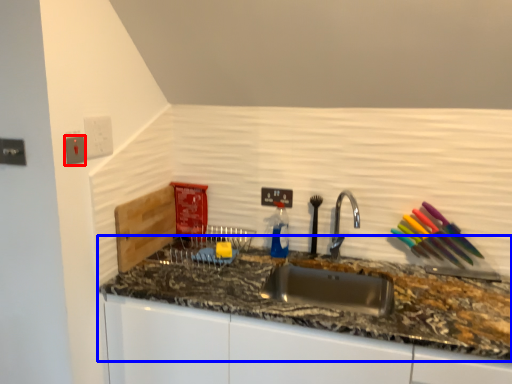
Question: Which of the following is the closest to the observer, electric outlet (highlighted by a red box) or countertop (highlighted by a blue box)?

Choices:
 (A) electric outlet
 (B) countertop

Answer: (B)